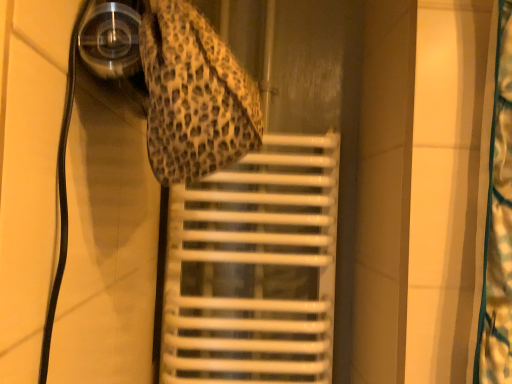
The height and width of the screenshot is (384, 512). Describe the element at coordinates (254, 268) in the screenshot. I see `white glossy radiator at center` at that location.

At what (x,y) coordinates should I click in order to perform the action: click on white glossy radiator at center. Please return your answer as a coordinate pair (x, y). This screenshot has height=384, width=512. Looking at the image, I should click on (254, 268).

Looking at this image, measure the distance between point (260, 188) and camera.

3.34 feet.

Where is `white glossy radiator at center`? white glossy radiator at center is located at coordinates (254, 268).